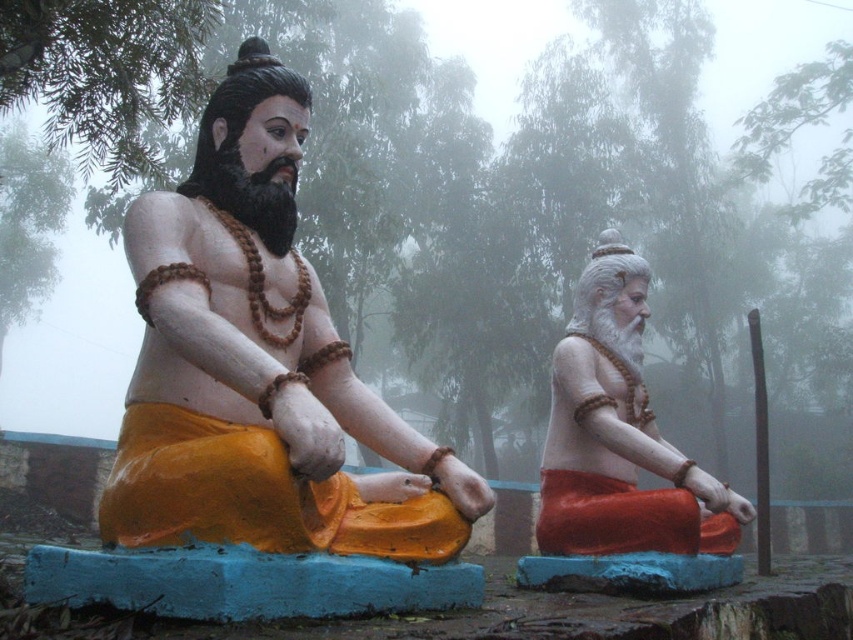
Can you confirm if matte orange statue at center is smaller than matte orange statue at right?

Actually, matte orange statue at center might be larger than matte orange statue at right.

Who is more forward, (256, 516) or (577, 436)?

Point (256, 516) is more forward.

Which is in front, point (183, 440) or point (674, 502)?

Point (183, 440) is in front.

Where is `matte orange statue at center`? This screenshot has height=640, width=853. matte orange statue at center is located at coordinates (259, 364).